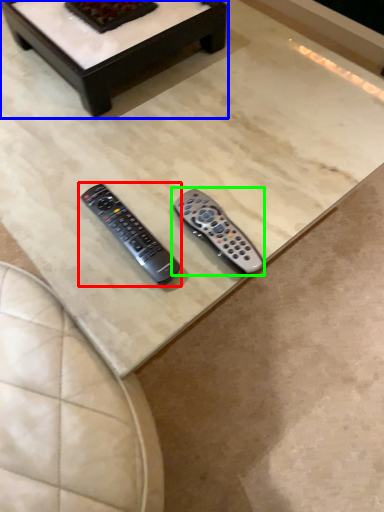
Question: Based on their relative distances, which object is nearer to remote control (highlighted by a red box)? Choose from coffee table (highlighted by a blue box) and remote control (highlighted by a green box).

Choices:
 (A) coffee table
 (B) remote control

Answer: (B)